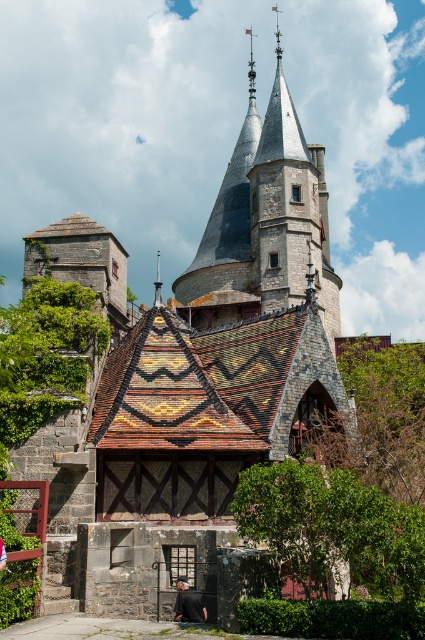
Question: Observing the image, what is the correct spatial positioning of smooth gray stone spire at upper center in reference to black leather jacket at lower center?

Choices:
 (A) above
 (B) below

Answer: (A)

Question: Considering the real-world distances, which object is closest to the dark blue fabric at center?

Choices:
 (A) black leather jacket at lower center
 (B) smooth gray stone spire at upper center

Answer: (A)

Question: Which point is farther to the camera?

Choices:
 (A) (186, 588)
 (B) (235, 244)

Answer: (B)

Question: Can you confirm if smooth gray stone spire at upper center is positioned above black leather jacket at lower center?

Choices:
 (A) yes
 (B) no

Answer: (A)

Question: Can you confirm if dark blue fabric at center is positioned above black leather jacket at lower center?

Choices:
 (A) no
 (B) yes

Answer: (A)

Question: Among these objects, which one is farthest from the camera?

Choices:
 (A) black leather jacket at lower center
 (B) smooth gray stone spire at upper center

Answer: (B)